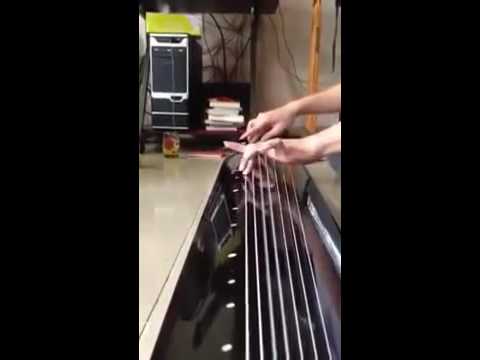
What are the coordinates of `amplifier` in the screenshot? It's located at (169, 76).